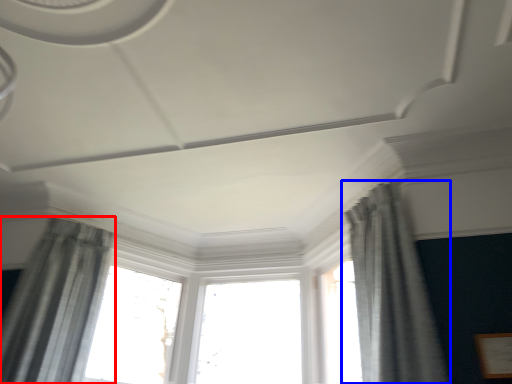
Question: Which object appears farthest to the camera in this image, curtain (highlighted by a red box) or curtain (highlighted by a blue box)?

Choices:
 (A) curtain
 (B) curtain

Answer: (A)